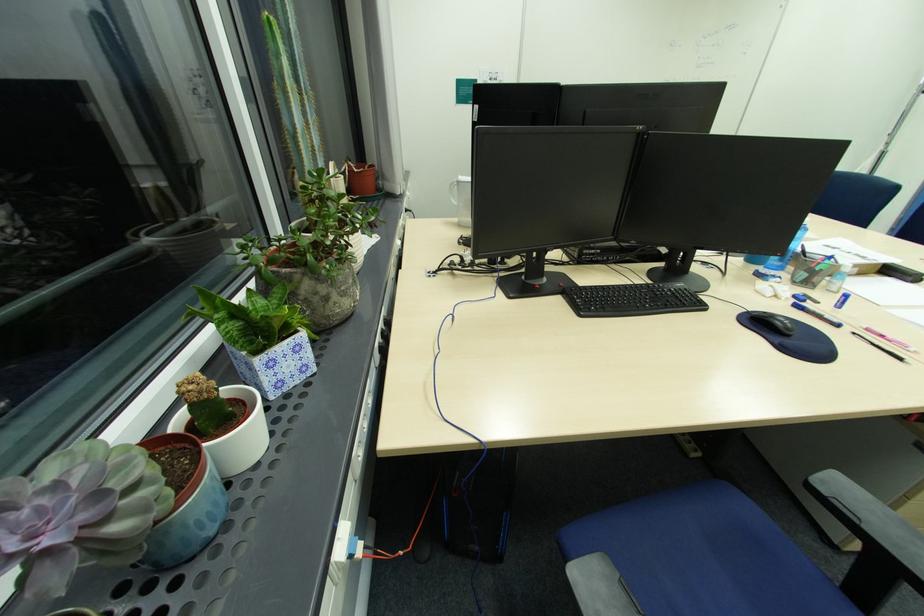
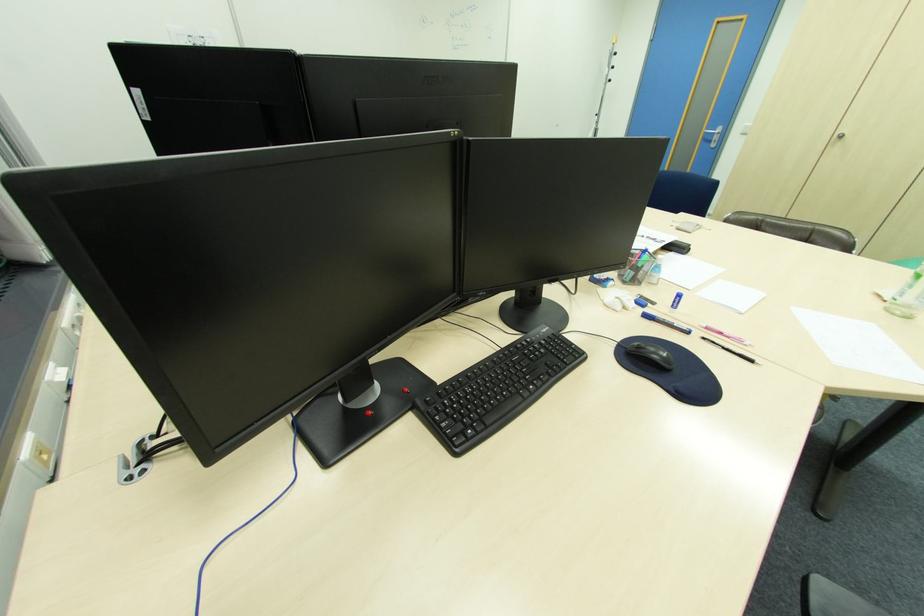
The point at [860,334] is marked in the first image. Where is the corresponding point in the second image?

(709, 339)